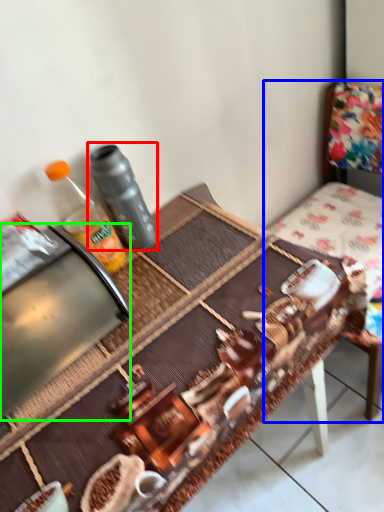
Question: Which object is positioned farthest from bottle (highlighted by a red box)? Select from chair (highlighted by a blue box) and appliance (highlighted by a green box).

Choices:
 (A) chair
 (B) appliance

Answer: (A)